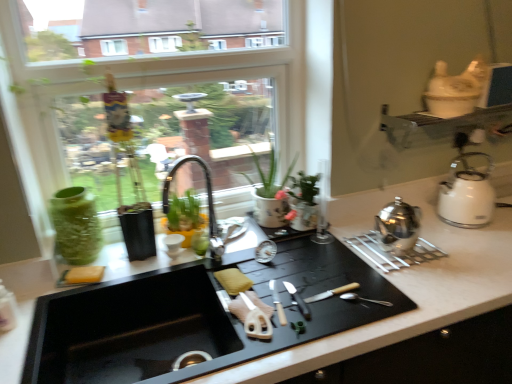
Question: Is silver metallic knife at center, arranged as the second knife when viewed from the right, taller than yellow sponge at sink, which is the 2th food in left-to-right order?

Choices:
 (A) no
 (B) yes

Answer: (A)

Question: From a real-world perspective, is silver metallic knife at center, which appears as the 1th knife when viewed from the left, physically above yellow sponge at sink, which is the 2th food in left-to-right order?

Choices:
 (A) yes
 (B) no

Answer: (B)

Question: Is there a large distance between silver metallic knife at center, arranged as the second knife when viewed from the right, and yellow sponge at sink, the first food in the right-to-left sequence?

Choices:
 (A) no
 (B) yes

Answer: (A)

Question: Is the surface of silver metallic knife at center, arranged as the second knife when viewed from the right, in direct contact with yellow sponge at sink, which is the 2th food in left-to-right order?

Choices:
 (A) no
 (B) yes

Answer: (A)

Question: From the image's perspective, is silver metallic knife at center, which appears as the 1th knife when viewed from the left, above yellow sponge at sink, the first food in the right-to-left sequence?

Choices:
 (A) yes
 (B) no

Answer: (B)

Question: From the image's perspective, would you say silver metallic knife at center, arranged as the second knife when viewed from the right, is shown under yellow sponge at sink, the first food in the right-to-left sequence?

Choices:
 (A) no
 (B) yes

Answer: (B)

Question: Is yellow sponge at sink, placed as the 1th food when sorted from left to right, surrounded by black matte countertop at center?

Choices:
 (A) no
 (B) yes

Answer: (B)

Question: Is black matte countertop at center thinner than yellow sponge at sink, the 2th food in the right-to-left sequence?

Choices:
 (A) no
 (B) yes

Answer: (A)

Question: From a real-world perspective, does black matte countertop at center sit lower than yellow sponge at sink, placed as the 1th food when sorted from left to right?

Choices:
 (A) no
 (B) yes

Answer: (B)

Question: Does black matte countertop at center come in front of yellow sponge at sink, placed as the 1th food when sorted from left to right?

Choices:
 (A) yes
 (B) no

Answer: (A)

Question: Does black matte countertop at center have a larger size compared to yellow sponge at sink, placed as the 1th food when sorted from left to right?

Choices:
 (A) yes
 (B) no

Answer: (A)

Question: Does black matte countertop at center have a lesser height compared to yellow sponge at sink, the 2th food in the right-to-left sequence?

Choices:
 (A) yes
 (B) no

Answer: (B)

Question: Is there a large distance between yellow sponge at sink, the 2th food in the right-to-left sequence, and yellow sponge at sink, which is the 2th food in left-to-right order?

Choices:
 (A) no
 (B) yes

Answer: (A)